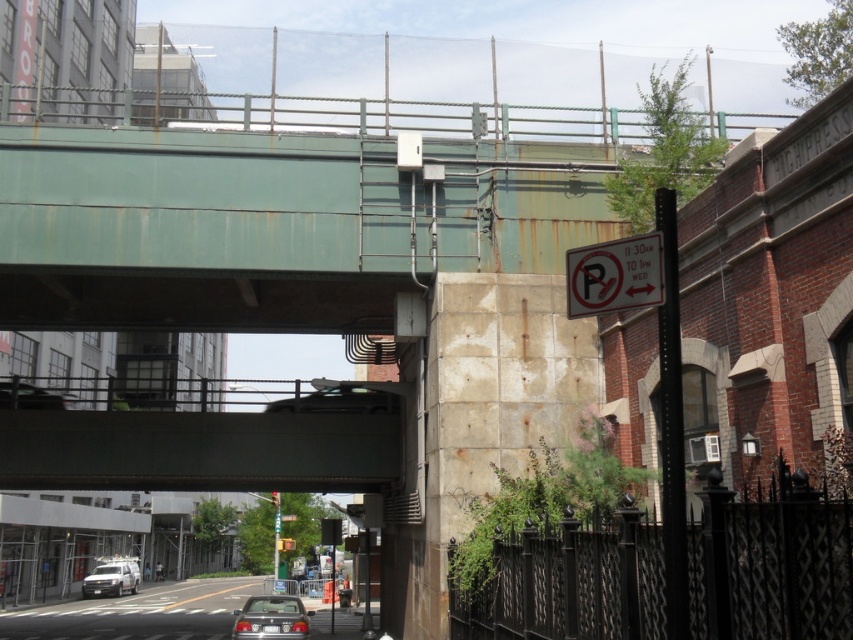
Question: Does dark gray concrete bridge at center appear under white plastic sign at upper right?

Choices:
 (A) no
 (B) yes

Answer: (B)

Question: Does dark gray concrete bridge at center appear under silver metallic van at lower left?

Choices:
 (A) yes
 (B) no

Answer: (B)

Question: Which is farther from the white plastic sign at upper right?

Choices:
 (A) silver metallic van at lower left
 (B) matte silver sedan at lower center

Answer: (A)

Question: Which object is positioned farthest from the white plastic sign at upper right?

Choices:
 (A) matte silver sedan at lower center
 (B) silver metallic van at lower left
 (C) dark gray concrete bridge at center

Answer: (B)

Question: Observing the image, what is the correct spatial positioning of white plastic sign at upper right in reference to silver metallic van at lower left?

Choices:
 (A) above
 (B) below

Answer: (A)

Question: Estimate the real-world distances between objects in this image. Which object is farther from the silver metallic van at lower left?

Choices:
 (A) white plastic sign at upper right
 (B) dark gray concrete bridge at center
 (C) matte silver sedan at lower center

Answer: (A)